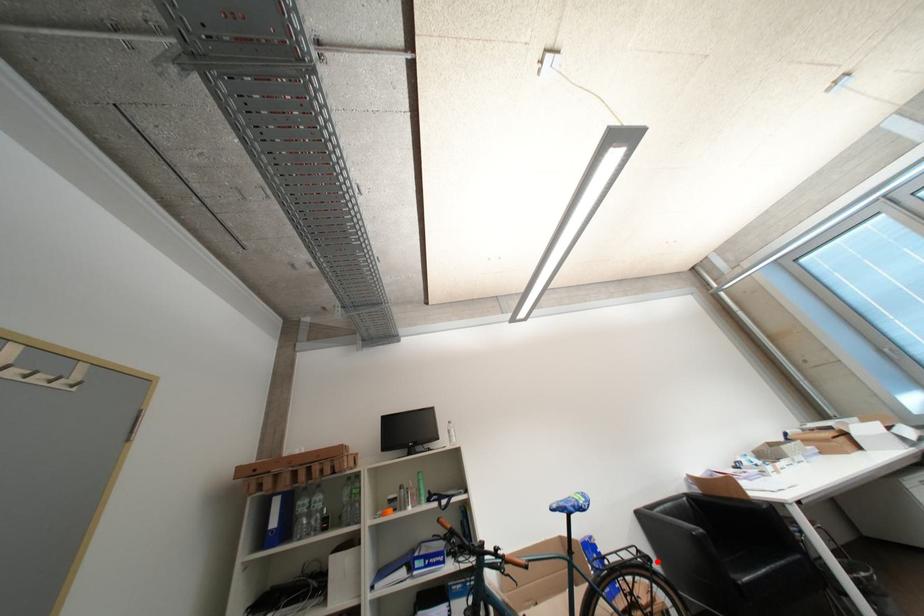
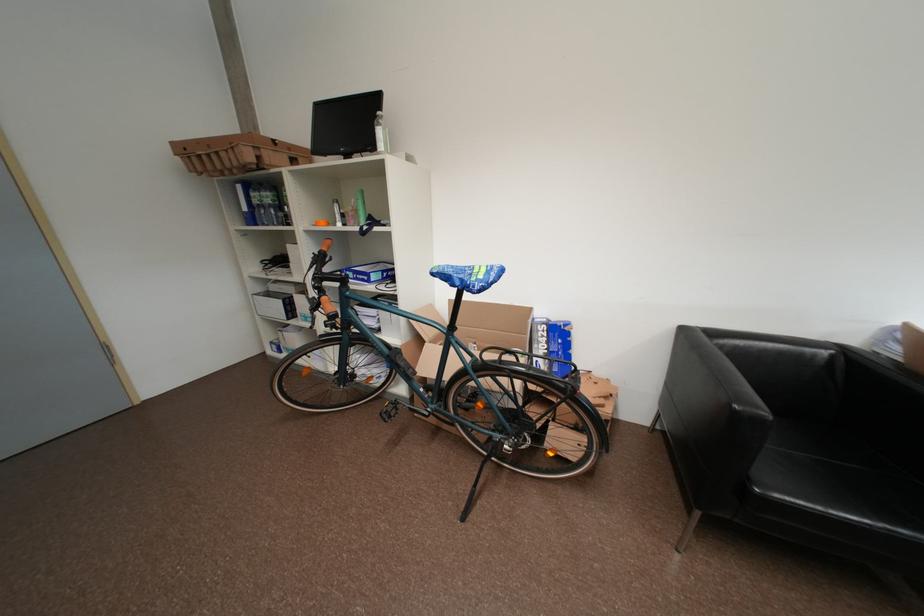
Where in the second image is the point corresponding to the highlighted location from the first image?

(582, 391)